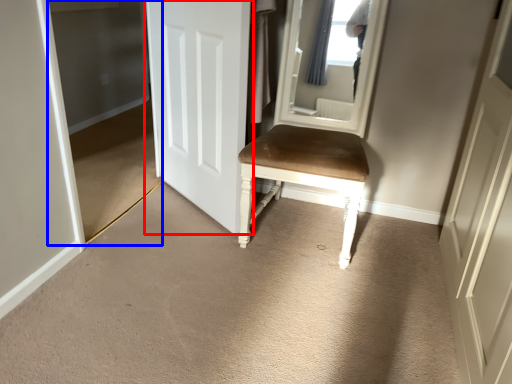
Question: Which object appears farthest to the camera in this image, door (highlighted by a red box) or glass door (highlighted by a blue box)?

Choices:
 (A) door
 (B) glass door

Answer: (A)